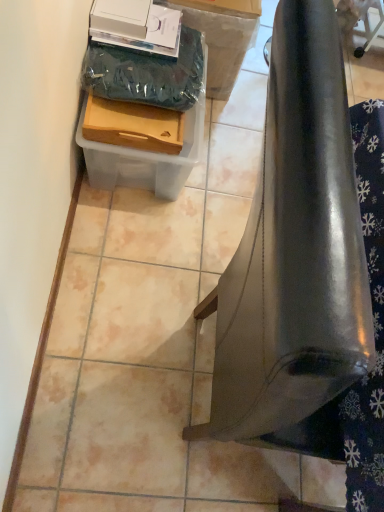
Where is `vacant space in front of clear plastic container at lower left, arranged as the first box when viewed from the back`? This screenshot has height=512, width=384. vacant space in front of clear plastic container at lower left, arranged as the first box when viewed from the back is located at coordinates (122, 244).